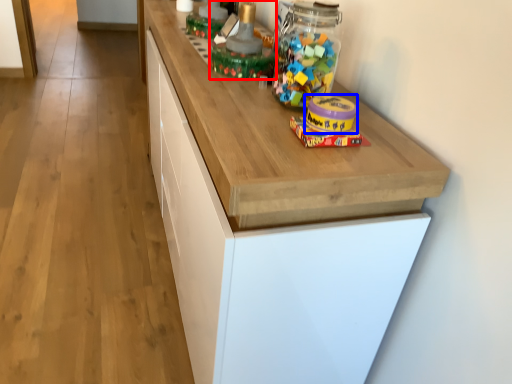
Question: Which point is closer to the camera, toy (highlighted by a red box) or toy (highlighted by a blue box)?

Choices:
 (A) toy
 (B) toy

Answer: (B)